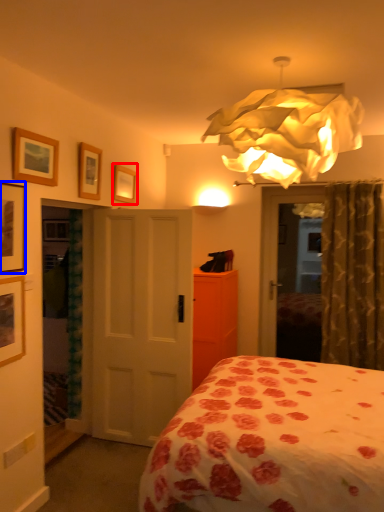
Question: Which point is closer to the camera, picture frame (highlighted by a red box) or picture frame (highlighted by a blue box)?

Choices:
 (A) picture frame
 (B) picture frame

Answer: (B)